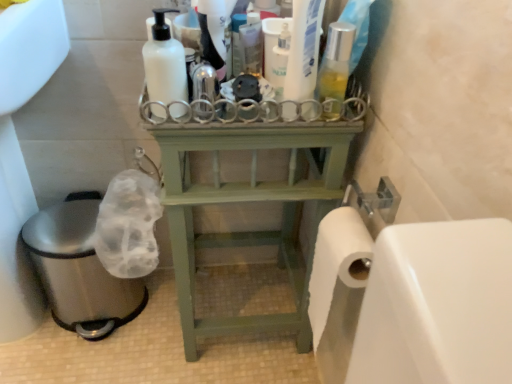
Question: Which direction should I rotate to face translucent plastic bottle at upper center, which appears as the second cleaning product when viewed from the right, — up or down?

Choices:
 (A) down
 (B) up

Answer: (B)

Question: Considering the relative positions of brushed metal sink at lower left and translucent plastic bottle at center, the first cleaning product from the right, in the image provided, is brushed metal sink at lower left in front of translucent plastic bottle at center, the first cleaning product from the right,?

Choices:
 (A) no
 (B) yes

Answer: (B)

Question: Are brushed metal sink at lower left and translucent plastic bottle at center, placed as the 4th cleaning product when sorted from left to right, located far from each other?

Choices:
 (A) no
 (B) yes

Answer: (A)

Question: Is brushed metal sink at lower left turned away from translucent plastic bottle at center, the first cleaning product from the right?

Choices:
 (A) yes
 (B) no

Answer: (B)

Question: Can translucent plastic bottle at center, placed as the 4th cleaning product when sorted from left to right, be found inside brushed metal sink at lower left?

Choices:
 (A) no
 (B) yes

Answer: (A)

Question: Is brushed metal sink at lower left thinner than translucent plastic bottle at center, placed as the 4th cleaning product when sorted from left to right?

Choices:
 (A) yes
 (B) no

Answer: (B)

Question: Does brushed metal sink at lower left have a larger size compared to translucent plastic bottle at center, placed as the 4th cleaning product when sorted from left to right?

Choices:
 (A) yes
 (B) no

Answer: (A)

Question: Can you confirm if brushed metal sink at lower left is shorter than translucent plastic spray bottle at center, which is the 3th cleaning product from right to left?

Choices:
 (A) yes
 (B) no

Answer: (B)

Question: From the image's perspective, is brushed metal sink at lower left located above translucent plastic spray bottle at center, which is the 3th cleaning product from right to left?

Choices:
 (A) no
 (B) yes

Answer: (A)

Question: Is brushed metal sink at lower left at the left side of translucent plastic spray bottle at center, which is the 3th cleaning product from right to left?

Choices:
 (A) yes
 (B) no

Answer: (A)

Question: Is brushed metal sink at lower left positioned beyond the bounds of translucent plastic spray bottle at center, which appears as the second cleaning product when viewed from the left?

Choices:
 (A) yes
 (B) no

Answer: (A)

Question: From a real-world perspective, is brushed metal sink at lower left beneath translucent plastic spray bottle at center, which is the 3th cleaning product from right to left?

Choices:
 (A) no
 (B) yes

Answer: (B)

Question: Does brushed metal sink at lower left have a smaller size compared to translucent plastic spray bottle at center, which appears as the second cleaning product when viewed from the left?

Choices:
 (A) yes
 (B) no

Answer: (B)

Question: Is translucent plastic spray bottle at center, which appears as the second cleaning product when viewed from the left, facing away from white matte bottle at upper center, the first cleaning product when ordered from left to right?

Choices:
 (A) yes
 (B) no

Answer: (B)